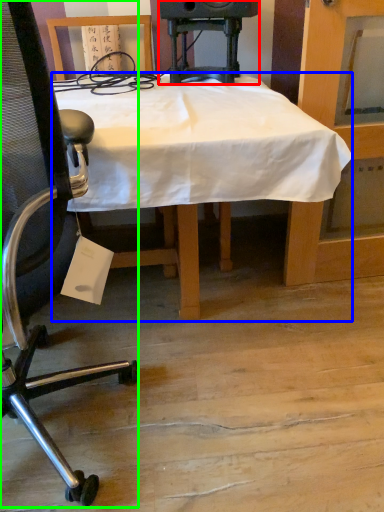
Question: Which object is positioned closest to speaker (highlighted by a red box)? Select from desk (highlighted by a blue box) and chair (highlighted by a green box).

Choices:
 (A) desk
 (B) chair

Answer: (A)